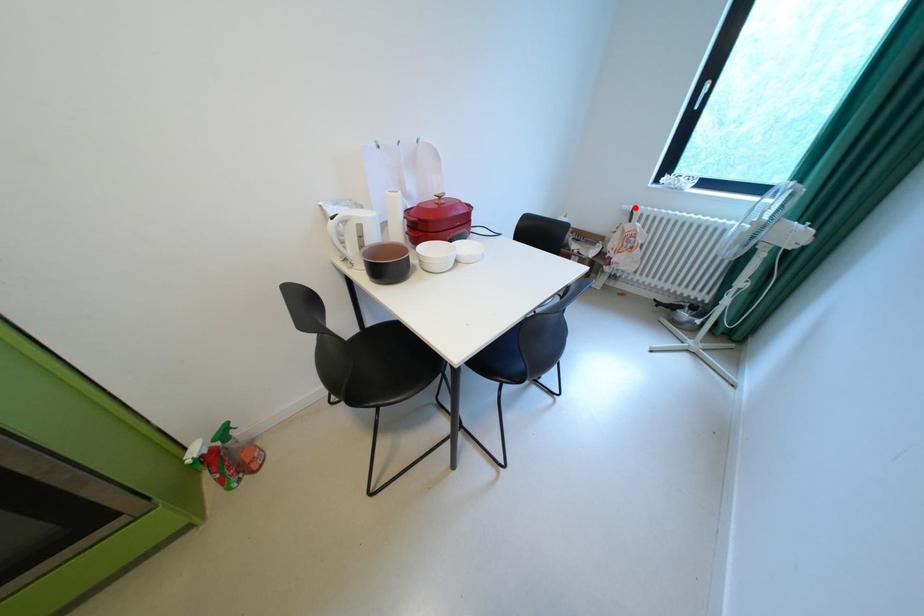
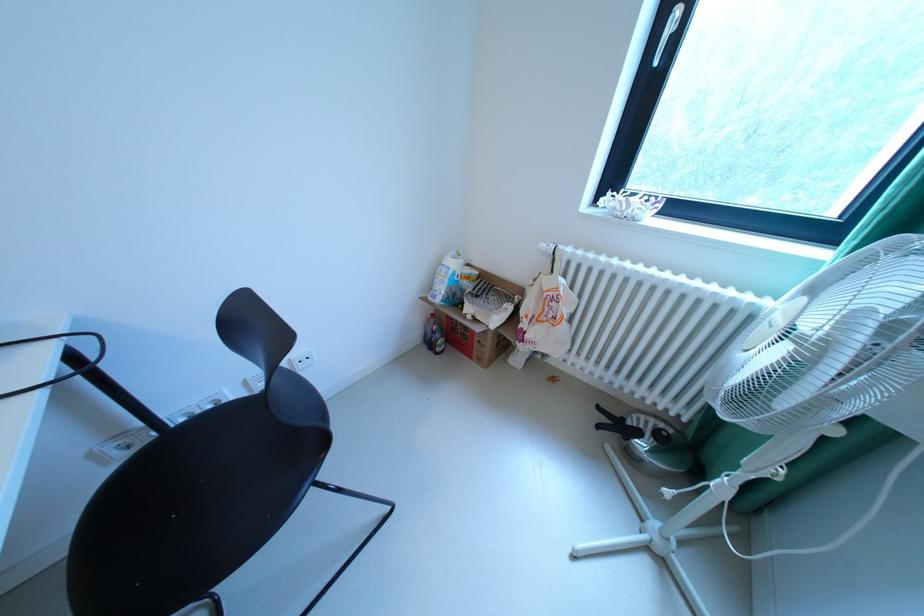
Question: I am providing you with two images of the same scene from different viewpoints. Given a red point in image1, look at the same physical point in image2. Is it:

Choices:
 (A) Closer to the viewpoint
 (B) Farther from the viewpoint

Answer: (B)